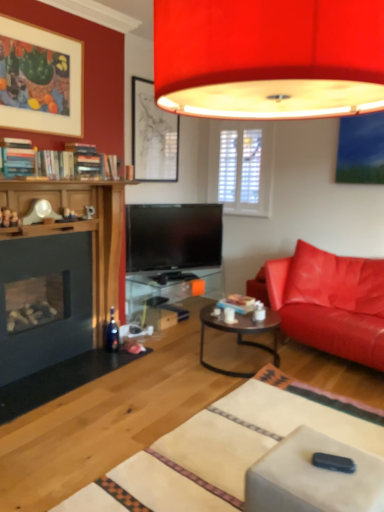
What do you see at coordinates (269, 58) in the screenshot? This screenshot has height=512, width=384. I see `matte red lampshade at upper center` at bounding box center [269, 58].

Measure the distance between point [80,96] and camera.

Point [80,96] is 3.27 meters from camera.

In order to click on matte red lampshade at upper center in this screenshot , I will do `click(269, 58)`.

Does matte red lampshade at upper center have a greater height compared to matte white picture frame at upper left, placed as the 1th picture frame when sorted from left to right?

Incorrect, the height of matte red lampshade at upper center is not larger of that of matte white picture frame at upper left, placed as the 1th picture frame when sorted from left to right.

How many degrees apart are the facing directions of matte red lampshade at upper center and matte white picture frame at upper left, placed as the 1th picture frame when sorted from left to right?

The angle between the facing direction of matte red lampshade at upper center and the facing direction of matte white picture frame at upper left, placed as the 1th picture frame when sorted from left to right, is 180 degrees.

From a real-world perspective, is matte red lampshade at upper center located higher than matte white picture frame at upper left, placed as the second picture frame when sorted from right to left?

No.

Can you confirm if matte red lampshade at upper center is positioned to the right of matte white picture frame at upper left, the 2th picture frame in the back-to-front sequence?

Indeed, matte red lampshade at upper center is positioned on the right side of matte white picture frame at upper left, the 2th picture frame in the back-to-front sequence.

From a real-world perspective, is matte black picture frame at upper center, the second picture frame positioned from the left, physically below transparent glass table at center?

Incorrect, from a real-world perspective, matte black picture frame at upper center, the second picture frame positioned from the left, is higher than transparent glass table at center.

Are matte black picture frame at upper center, the 2th picture frame when ordered from front to back, and transparent glass table at center beside each other?

No, matte black picture frame at upper center, the 2th picture frame when ordered from front to back, is not next to transparent glass table at center.

Which object is more forward, matte black picture frame at upper center, marked as the first picture frame in a back-to-front arrangement, or transparent glass table at center?

Positioned in front is transparent glass table at center.

Does point (147, 89) come closer to viewer compared to point (159, 286)?

Yes, point (147, 89) is closer to viewer.

From a real-world perspective, is transparent glass table at center over matte white picture frame at upper left, the 1th picture frame when ordered from front to back?

Actually, transparent glass table at center is physically below matte white picture frame at upper left, the 1th picture frame when ordered from front to back, in the real world.

Considering the relative sizes of transparent glass table at center and matte white picture frame at upper left, the 2th picture frame in the back-to-front sequence, in the image provided, is transparent glass table at center shorter than matte white picture frame at upper left, the 2th picture frame in the back-to-front sequence,?

Indeed, transparent glass table at center has a lesser height compared to matte white picture frame at upper left, the 2th picture frame in the back-to-front sequence.

Is transparent glass table at center with matte white picture frame at upper left, placed as the second picture frame when sorted from right to left?

No, transparent glass table at center is not next to matte white picture frame at upper left, placed as the second picture frame when sorted from right to left.

From the image's perspective, is transparent glass table at center positioned above or below matte white picture frame at upper left, placed as the 1th picture frame when sorted from left to right?

Based on their image positions, transparent glass table at center is located beneath matte white picture frame at upper left, placed as the 1th picture frame when sorted from left to right.

From a real-world perspective, is black plastic swivel chair at center over matte black picture frame at upper center, marked as the first picture frame in a back-to-front arrangement?

No, from a real-world perspective, black plastic swivel chair at center is not on top of matte black picture frame at upper center, marked as the first picture frame in a back-to-front arrangement.

Would you say black plastic swivel chair at center contains matte black picture frame at upper center, the 1th picture frame from the right?

No, matte black picture frame at upper center, the 1th picture frame from the right, is not inside black plastic swivel chair at center.

Which of these two, black plastic swivel chair at center or matte black picture frame at upper center, marked as the first picture frame in a back-to-front arrangement, stands shorter?

Standing shorter between the two is black plastic swivel chair at center.

Based on the photo, which is more to the left, leather couch at right or matte red lampshade at upper center?

From the viewer's perspective, matte red lampshade at upper center appears more on the left side.

How much distance is there between leather couch at right and matte red lampshade at upper center?

leather couch at right and matte red lampshade at upper center are 2.05 meters apart.

Is leather couch at right oriented away from matte red lampshade at upper center?

No, leather couch at right's orientation is not away from matte red lampshade at upper center.

In the scene shown: From the image's perspective, is leather couch at right above matte red lampshade at upper center?

No, from the image's perspective, leather couch at right is not over matte red lampshade at upper center.

Is point (129, 280) less distant than point (289, 298)?

That is False.

Between transparent glass table at center and leather couch at right, which one is positioned in front?

leather couch at right is closer to the camera.

Find the location of a particular element. The image size is (384, 512). studio couch above the transparent glass table at center (from a real-world perspective) is located at coordinates (330, 302).

From the image's perspective, who appears lower, transparent glass table at center or leather couch at right?

From the image's view, transparent glass table at center is below.

Which of these two, leather couch at right or transparent glass table at center, stands taller?

Standing taller between the two is leather couch at right.

How different are the orientations of leather couch at right and transparent glass table at center in degrees?

102 degrees separate the facing orientations of leather couch at right and transparent glass table at center.

Where is `studio couch located above the transparent glass table at center (from a real-world perspective)`? The image size is (384, 512). studio couch located above the transparent glass table at center (from a real-world perspective) is located at coordinates (330, 302).

Considering the sizes of objects leather couch at right and transparent glass table at center in the image provided, who is bigger, leather couch at right or transparent glass table at center?

With larger size is leather couch at right.

I want to click on lamp that appears below the matte white picture frame at upper left, placed as the second picture frame when sorted from right to left (from the image's perspective), so click(269, 58).

Image resolution: width=384 pixels, height=512 pixels. I want to click on the 1st picture frame located above the transparent glass table at center (from a real-world perspective), so click(x=153, y=136).

Looking at the image, which one is located further to matte red lampshade at upper center, matte black picture frame at upper center, marked as the first picture frame in a back-to-front arrangement, or transparent glass table at center?

transparent glass table at center is positioned further to the anchor matte red lampshade at upper center.

From the image, which object appears to be nearer to matte black coffee table at center, matte red lampshade at upper center or matte white picture frame at upper left, placed as the second picture frame when sorted from right to left?

Based on the image, matte red lampshade at upper center appears to be nearer to matte black coffee table at center.

Considering their positions, is black plastic swivel chair at center positioned further to leather couch at right than matte red lampshade at upper center?

Among the two, matte red lampshade at upper center is located further to leather couch at right.

Considering their positions, is black plastic swivel chair at center positioned further to matte black coffee table at center than matte white picture frame at upper left, placed as the 1th picture frame when sorted from left to right?

matte white picture frame at upper left, placed as the 1th picture frame when sorted from left to right, lies further to matte black coffee table at center than the other object.

In the scene shown: Based on their spatial positions, is black plastic swivel chair at center or matte black coffee table at center further from transparent glass table at center?

black plastic swivel chair at center is positioned further to the anchor transparent glass table at center.

Considering their positions, is leather couch at right positioned closer to transparent glass table at center than black plastic swivel chair at center?

leather couch at right is closer to transparent glass table at center.

Considering their positions, is matte white picture frame at upper left, the 2th picture frame in the back-to-front sequence, positioned further to black plastic swivel chair at center than matte black picture frame at upper center, the second picture frame positioned from the left?

Among the two, matte black picture frame at upper center, the second picture frame positioned from the left, is located further to black plastic swivel chair at center.

Looking at this image, based on their spatial positions, is matte red lampshade at upper center or matte white picture frame at upper left, placed as the second picture frame when sorted from right to left, closer to transparent glass table at center?

Based on the image, matte white picture frame at upper left, placed as the second picture frame when sorted from right to left, appears to be nearer to transparent glass table at center.

At what (x,y) coordinates should I click in order to perform the action: click on picture frame between matte white picture frame at upper left, placed as the second picture frame when sorted from right to left, and leather couch at right from left to right. Please return your answer as a coordinate pair (x, y). Image resolution: width=384 pixels, height=512 pixels. Looking at the image, I should click on (153, 136).

Image resolution: width=384 pixels, height=512 pixels. Find the location of `coffee table located between matte red lampshade at upper center and transparent glass table at center in the depth direction`. coffee table located between matte red lampshade at upper center and transparent glass table at center in the depth direction is located at coordinates (241, 335).

Image resolution: width=384 pixels, height=512 pixels. Identify the location of coffee table between black plastic swivel chair at center and transparent glass table at center in the front-back direction. (241, 335).

The width and height of the screenshot is (384, 512). Identify the location of studio couch between matte red lampshade at upper center and transparent glass table at center in the front-back direction. pos(330,302).